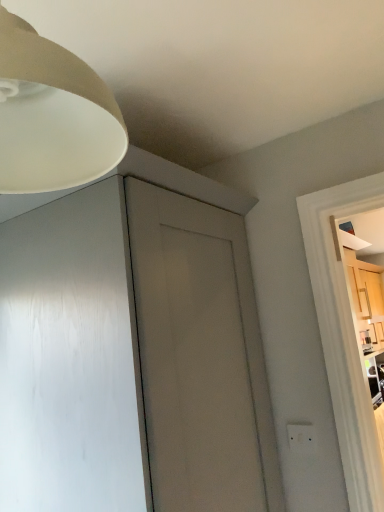
Question: From the image's perspective, relative to matte white lampshade at upper left, is white plastic electric outlet at lower right above or below?

Choices:
 (A) above
 (B) below

Answer: (B)

Question: Considering the positions of point (314, 442) and point (76, 96), is point (314, 442) closer or farther from the camera than point (76, 96)?

Choices:
 (A) closer
 (B) farther

Answer: (B)

Question: Would you say white plastic electric outlet at lower right is inside or outside matte white lampshade at upper left?

Choices:
 (A) inside
 (B) outside

Answer: (B)

Question: Which is correct: matte white lampshade at upper left is inside white plastic electric outlet at lower right, or outside of it?

Choices:
 (A) inside
 (B) outside

Answer: (B)

Question: From the image's perspective, is matte white lampshade at upper left located above or below white plastic electric outlet at lower right?

Choices:
 (A) below
 (B) above

Answer: (B)

Question: Considering their positions, is matte white lampshade at upper left located in front of or behind white plastic electric outlet at lower right?

Choices:
 (A) front
 (B) behind

Answer: (A)

Question: Looking at their shapes, would you say matte white lampshade at upper left is wider or thinner than white plastic electric outlet at lower right?

Choices:
 (A) wide
 (B) thin

Answer: (A)